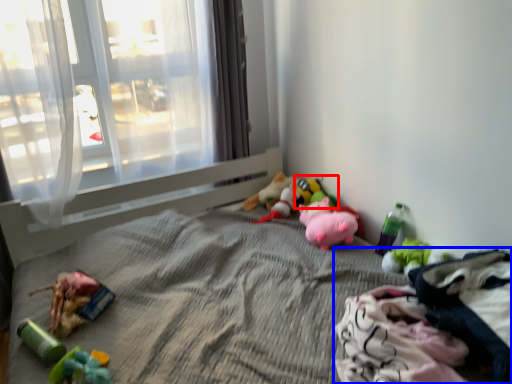
Question: Which point is closer to the camera, toy (highlighted by a red box) or material (highlighted by a blue box)?

Choices:
 (A) toy
 (B) material

Answer: (B)